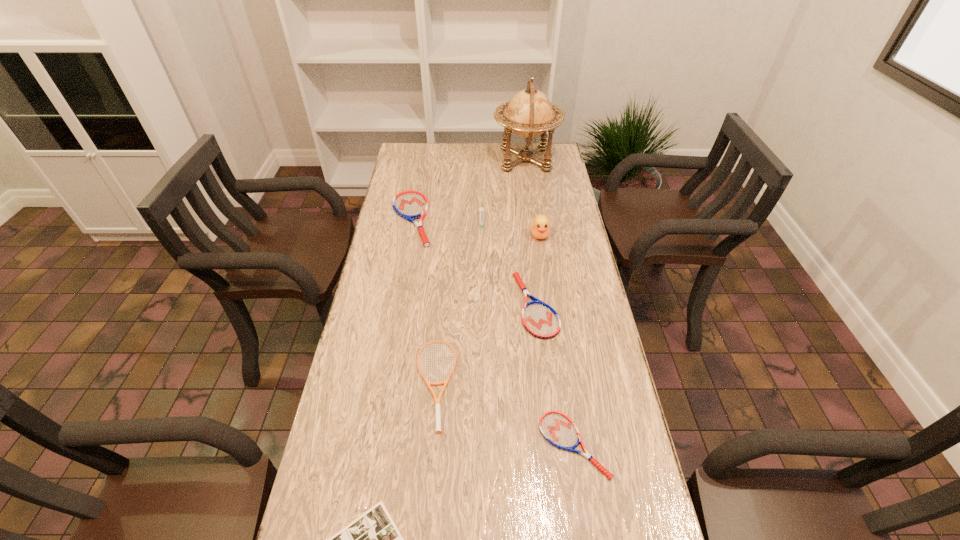
Locate an element on the screen. The width and height of the screenshot is (960, 540). free space located on the back of the beige tennis racket is located at coordinates (442, 303).

Find the location of a particular element. The width and height of the screenshot is (960, 540). vacant space situated 0.090m on the back of the shortest tennis racket is located at coordinates (564, 382).

The width and height of the screenshot is (960, 540). I want to click on object that is at the far edge, so click(x=529, y=113).

Locate an element on the screen. object that is at the left edge is located at coordinates (410, 205).

Where is `globe that is at the right edge`? This screenshot has width=960, height=540. globe that is at the right edge is located at coordinates (529, 113).

Locate an element on the screen. This screenshot has height=540, width=960. duckling that is positioned at the right edge is located at coordinates (540, 227).

Identify the location of object situated at the far right corner. Image resolution: width=960 pixels, height=540 pixels. (529, 113).

The width and height of the screenshot is (960, 540). In order to click on free region at the far edge in this screenshot , I will do [476, 165].

Where is `free space at the left edge of the desktop`? The height and width of the screenshot is (540, 960). free space at the left edge of the desktop is located at coordinates (414, 178).

I want to click on free space at the right edge, so (x=553, y=213).